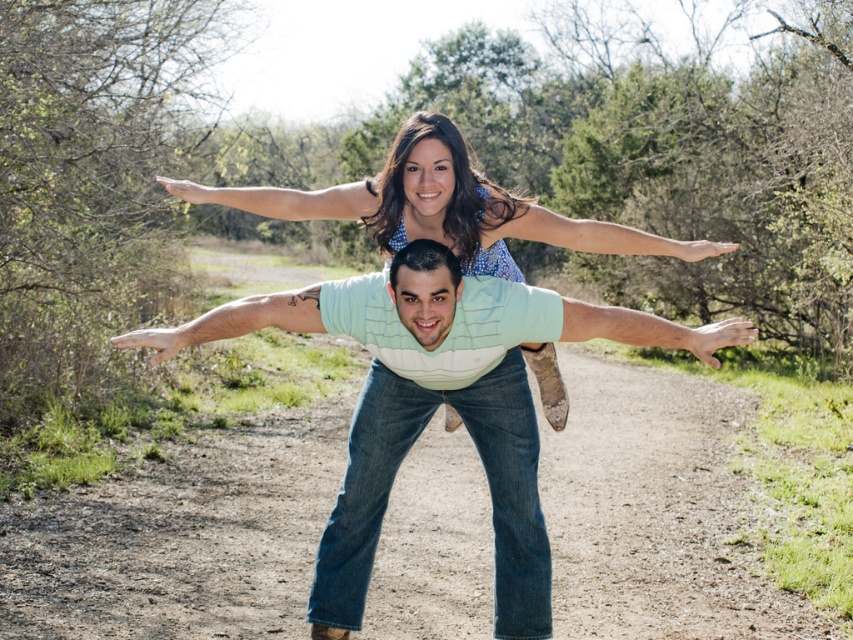
Question: Which object appears farthest from the camera in this image?

Choices:
 (A) light blue denim jeans at center
 (B) brown dirt track at center

Answer: (B)

Question: Is brown dirt track at center thinner than light blue denim jeans at center?

Choices:
 (A) no
 (B) yes

Answer: (A)

Question: Among these points, which one is nearest to the camera?

Choices:
 (A) (688, 499)
 (B) (422, 413)

Answer: (B)

Question: Is brown dirt track at center to the right of light blue denim jeans at center from the viewer's perspective?

Choices:
 (A) no
 (B) yes

Answer: (B)

Question: Is brown dirt track at center smaller than light blue denim jeans at center?

Choices:
 (A) yes
 (B) no

Answer: (B)